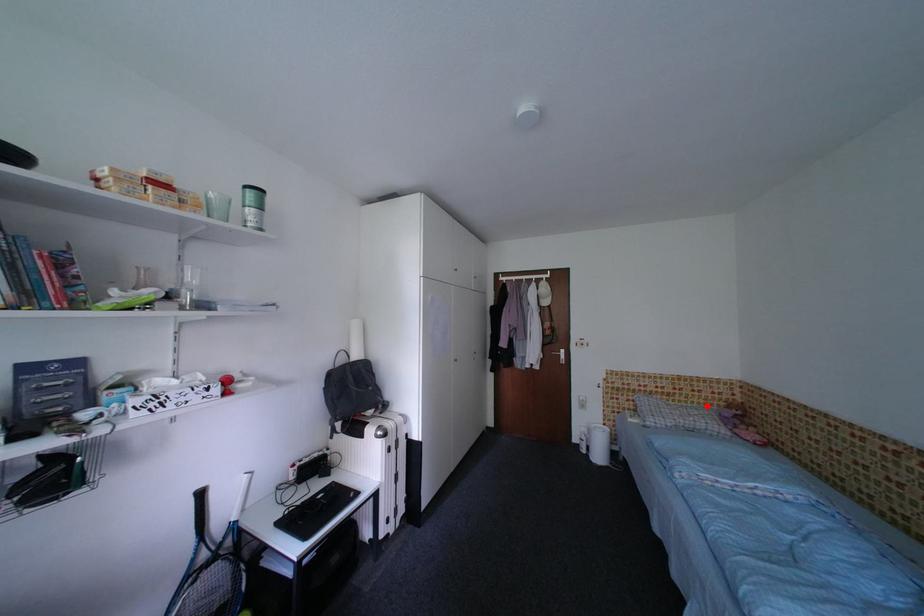
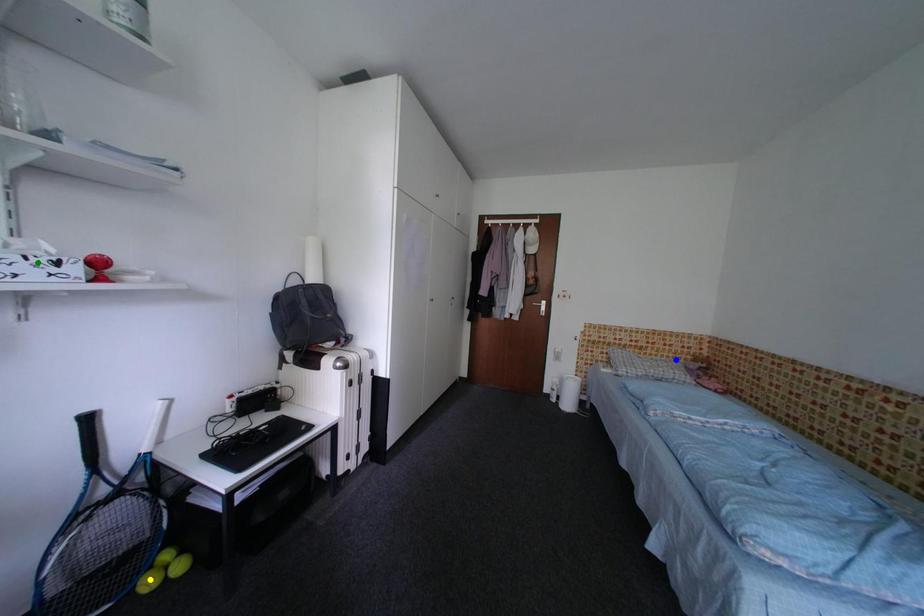
Question: I am providing you with two images of the same scene from different viewpoints. A red point is marked on the first image. You are given multiple points on the second image. Which spot in image 2 lines up with the point in image 1?

Choices:
 (A) yellow point
 (B) green point
 (C) blue point

Answer: (C)